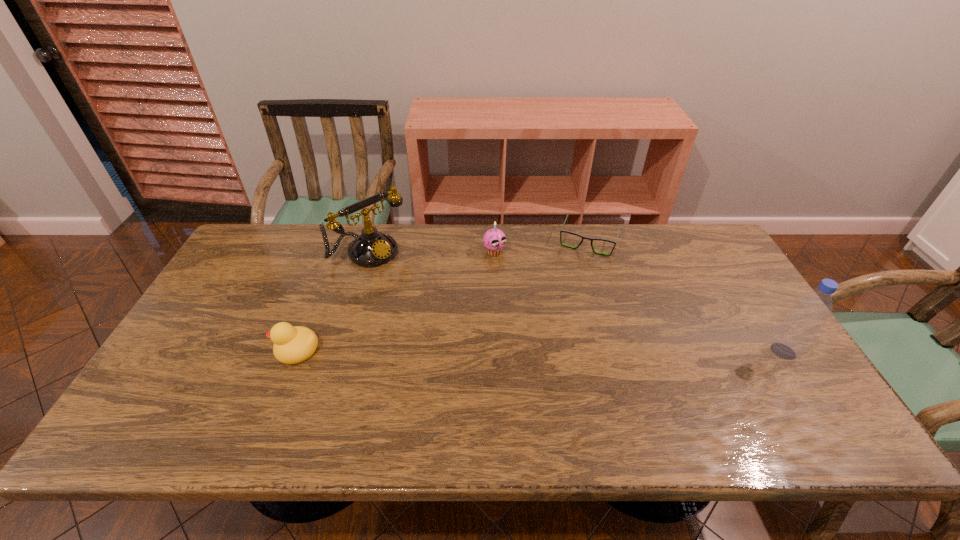
This screenshot has width=960, height=540. Identify the location of vacant space on the desktop that is between the fourth tallest object and the bottle and is positioned on the face of the cupcake. (587, 350).

I want to click on vacant space on the desktop that is between the duckling and the bottle and is positioned on the dial of the telephone, so click(x=486, y=350).

Where is `vacant spot on the desktop that is between the fourth tallest object and the rightmost object and is positioned on the lens of the shortest object`? vacant spot on the desktop that is between the fourth tallest object and the rightmost object and is positioned on the lens of the shortest object is located at coordinates tap(552, 350).